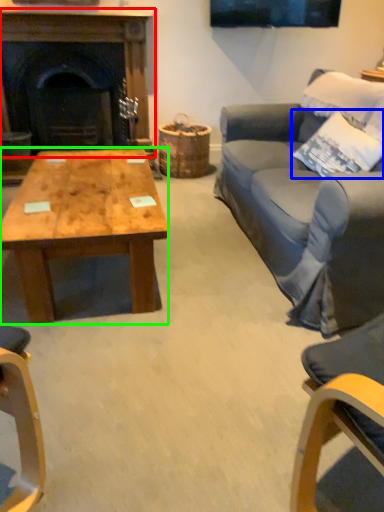
Question: Which object is the farthest from fireplace (highlighted by a red box)? Choose among these: pillow (highlighted by a blue box) or coffee table (highlighted by a green box).

Choices:
 (A) pillow
 (B) coffee table

Answer: (A)